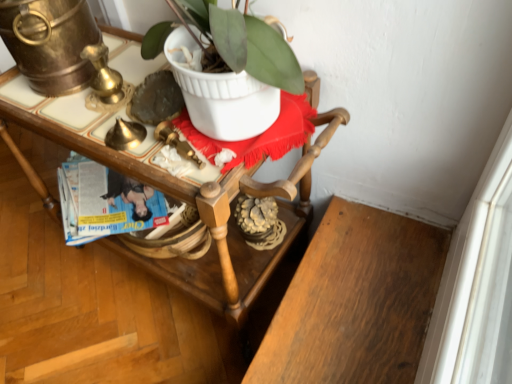
Question: In terms of width, does blue glossy magazine at center look wider or thinner when compared to wooden desk at center?

Choices:
 (A) thin
 (B) wide

Answer: (A)

Question: From the image's perspective, is blue glossy magazine at center located above or below wooden desk at center?

Choices:
 (A) below
 (B) above

Answer: (B)

Question: Would you say blue glossy magazine at center is inside or outside wooden desk at center?

Choices:
 (A) inside
 (B) outside

Answer: (A)

Question: In terms of width, does wooden desk at center look wider or thinner when compared to blue glossy magazine at center?

Choices:
 (A) thin
 (B) wide

Answer: (B)

Question: In terms of size, does wooden desk at center appear bigger or smaller than blue glossy magazine at center?

Choices:
 (A) big
 (B) small

Answer: (A)

Question: Is wooden desk at center inside or outside of blue glossy magazine at center?

Choices:
 (A) outside
 (B) inside

Answer: (A)

Question: From a real-world perspective, is wooden desk at center above or below blue glossy magazine at center?

Choices:
 (A) below
 (B) above

Answer: (B)